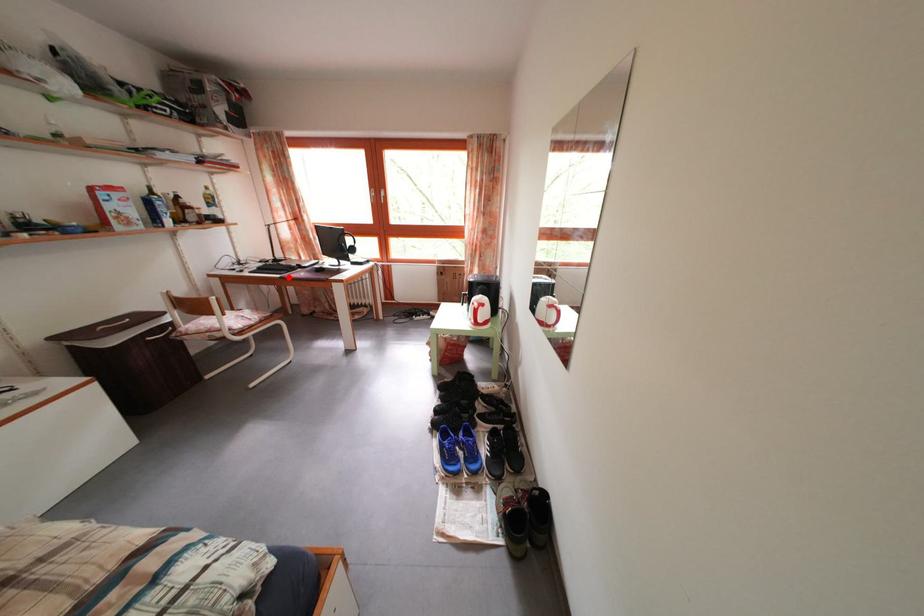
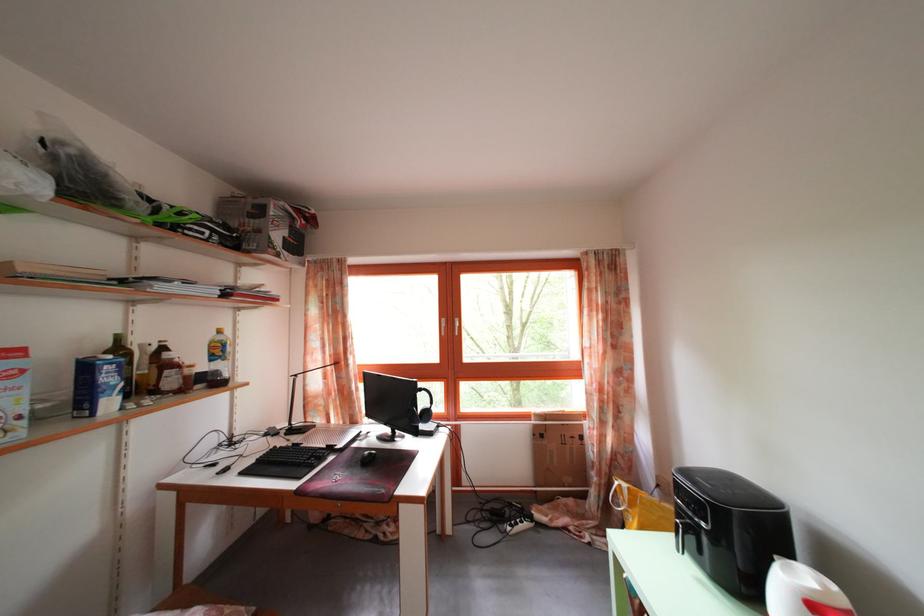
Locate, in the second image, the point that corresponds to the highlighted location in the first image.

(307, 472)